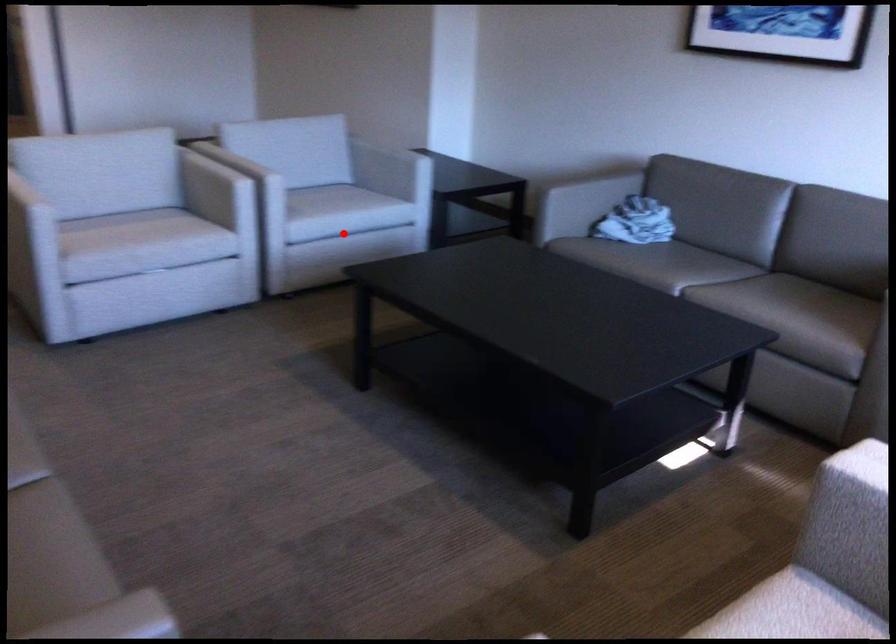
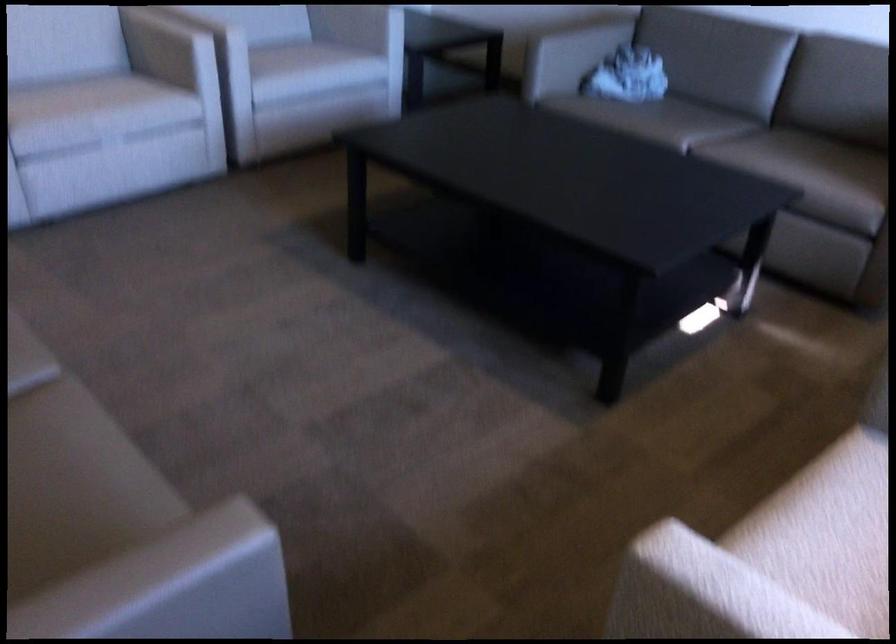
Locate, in the second image, the point that corresponds to the highlighted location in the first image.

(314, 91)